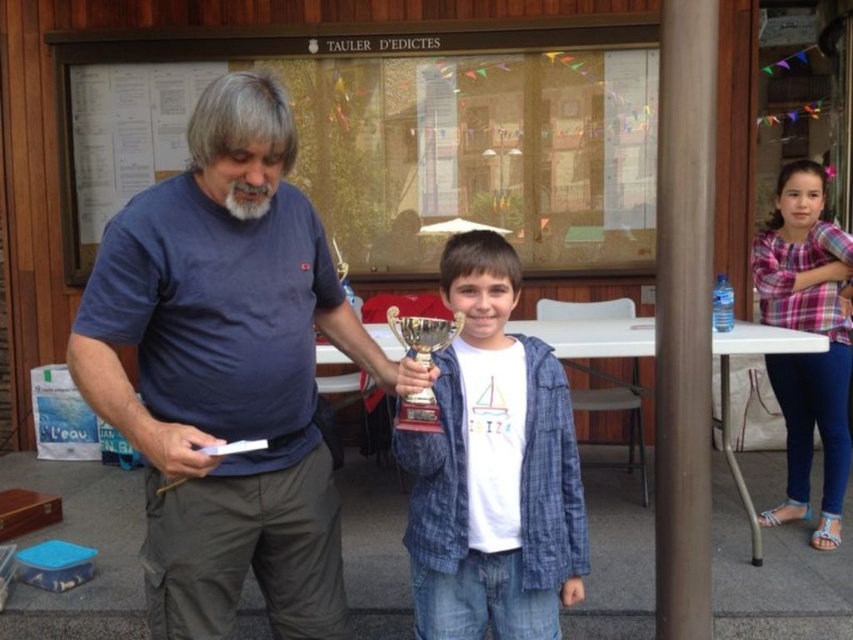
Question: Does plaid shirt at right have a larger size compared to grayhairbeard at center?

Choices:
 (A) no
 (B) yes

Answer: (B)

Question: Based on their relative distances, which object is farther from the gold metallic trophy at center?

Choices:
 (A) blue cotton shirt at center
 (B) plaid shirt at right
 (C) grayhairbeard at center

Answer: (B)

Question: Considering the real-world distances, which object is farthest from the blue cotton shirt at center?

Choices:
 (A) grayhairbeard at center
 (B) white matte trophy at center

Answer: (A)

Question: Is white matte trophy at center wider than gold metallic trophy at center?

Choices:
 (A) no
 (B) yes

Answer: (B)

Question: Does white matte trophy at center appear over gold metallic trophy at center?

Choices:
 (A) no
 (B) yes

Answer: (A)

Question: Which object is the closest to the gold metallic trophy at center?

Choices:
 (A) plaid shirt at right
 (B) grayhairbeard at center
 (C) blue cotton shirt at center
 (D) white matte trophy at center

Answer: (D)